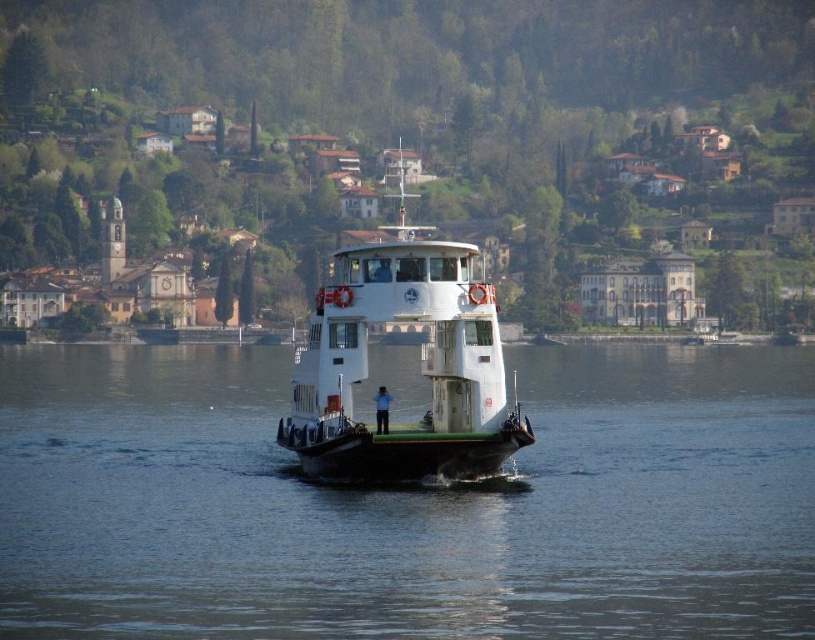
Does clear water at center have a lesser width compared to white matte ferryboat at center?

No, clear water at center is not thinner than white matte ferryboat at center.

Can you confirm if clear water at center is positioned to the left of white matte ferryboat at center?

Incorrect, clear water at center is not on the left side of white matte ferryboat at center.

Which is in front, point (294, 556) or point (364, 323)?

Positioned in front is point (294, 556).

I want to click on clear water at center, so click(406, 504).